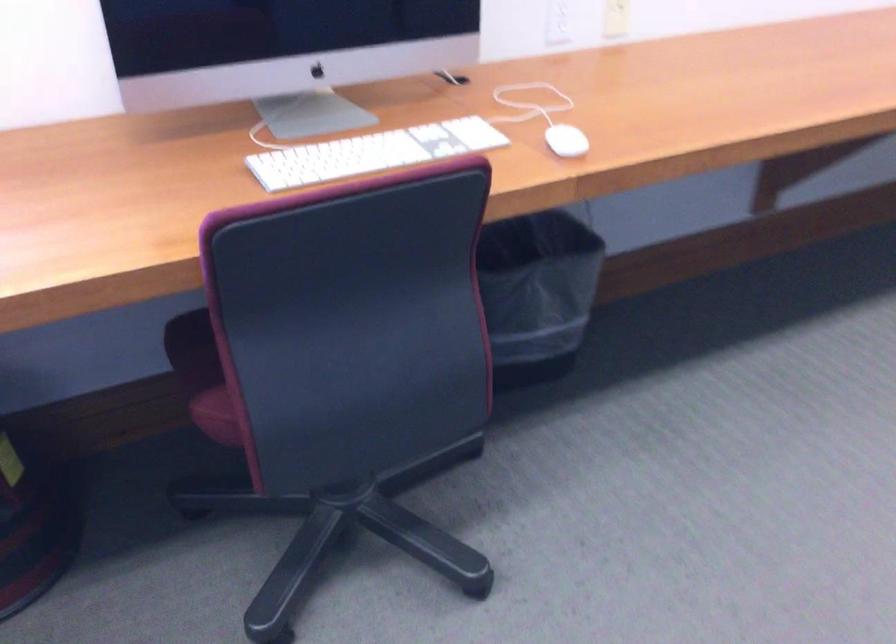
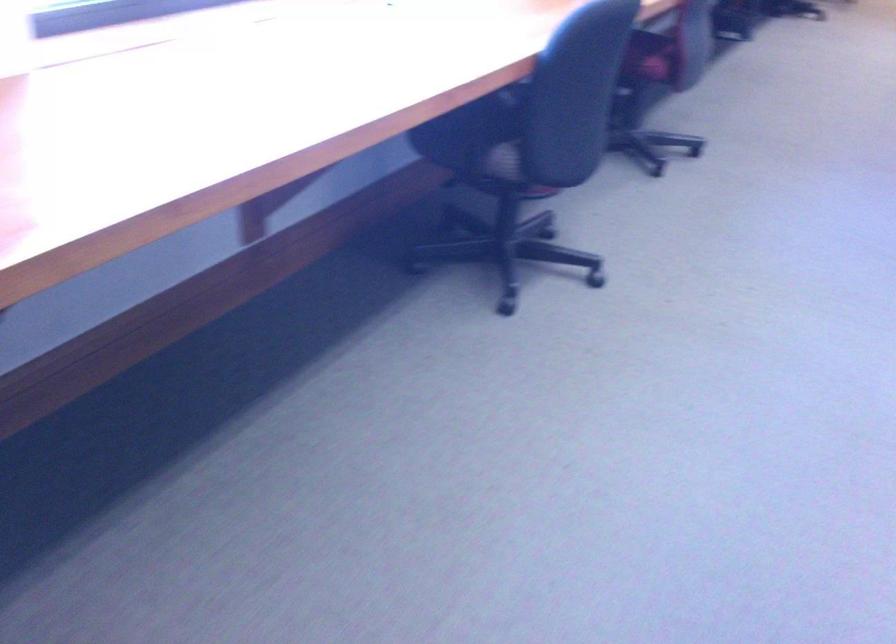
The images are taken continuously from a first-person perspective. In which direction are you moving?

The cameraman moved toward left, backward.